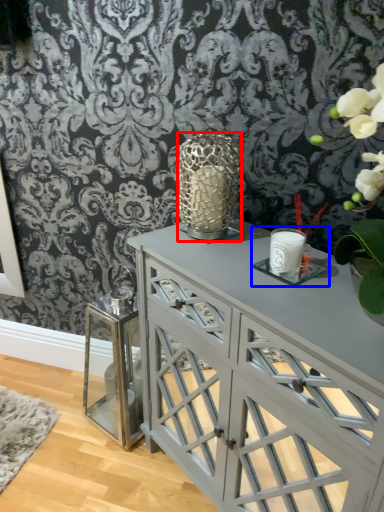
Question: Which of the following is the farthest to the observer, candle holder (highlighted by a red box) or candle holder (highlighted by a blue box)?

Choices:
 (A) candle holder
 (B) candle holder

Answer: (A)